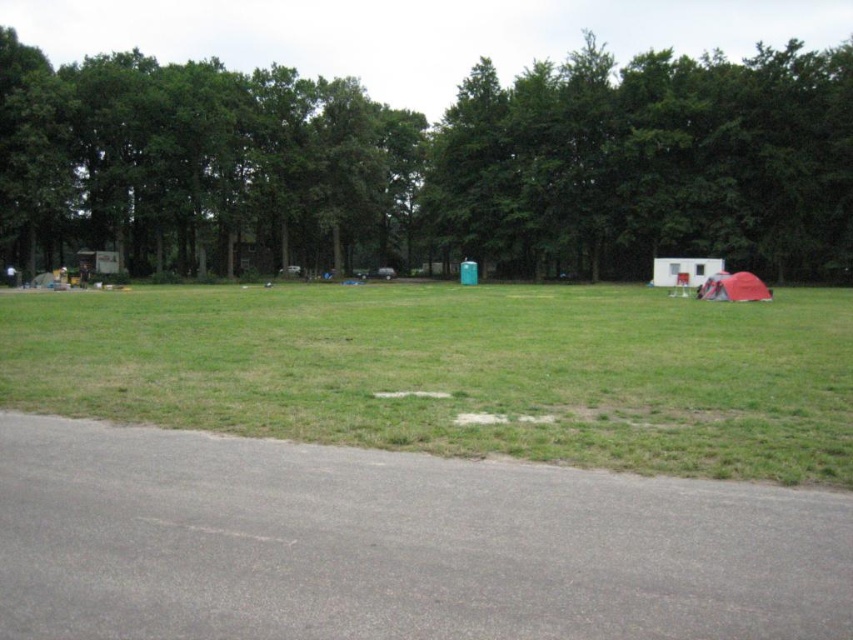
Question: Which point is closer to the camera taking this photo?

Choices:
 (A) (381, 145)
 (B) (457, 324)
 (C) (729, 289)

Answer: (B)

Question: Is green leafy tree at upper center above green grass at center?

Choices:
 (A) yes
 (B) no

Answer: (A)

Question: Is the position of green leafy tree at upper center less distant than that of red fabric tent at lower right?

Choices:
 (A) no
 (B) yes

Answer: (A)

Question: Which of the following is the closest to the observer?

Choices:
 (A) red fabric tent at lower right
 (B) green leafy tree at upper center
 (C) green grass at center

Answer: (C)

Question: Which of these objects is positioned farthest from the green leafy tree at upper center?

Choices:
 (A) red fabric tent at lower right
 (B) green grass at center

Answer: (A)

Question: Can you confirm if green leafy tree at upper center is thinner than red fabric tent at lower right?

Choices:
 (A) yes
 (B) no

Answer: (B)